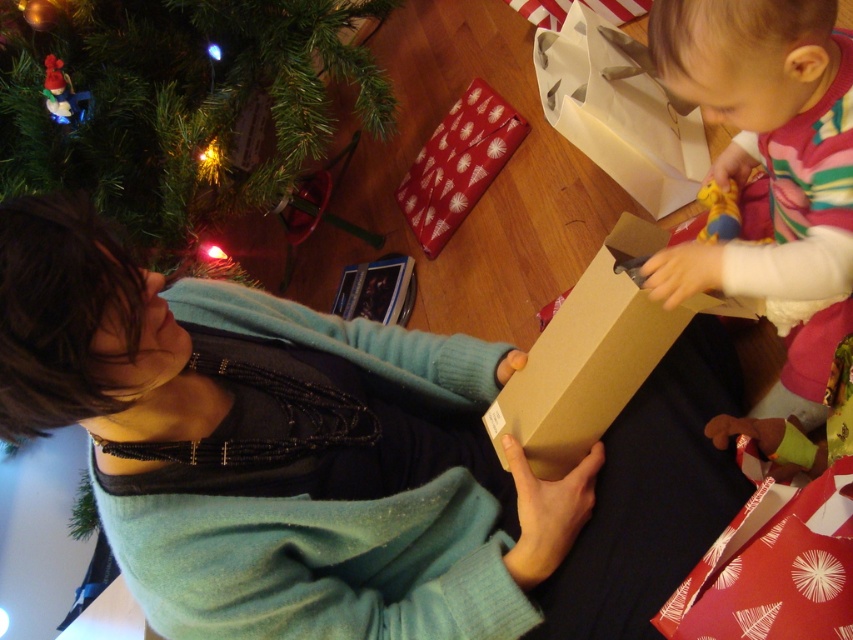
Can you confirm if green matte christmas tree at upper left is positioned to the right of striped fleece sweater at lower right?

Incorrect, green matte christmas tree at upper left is not on the right side of striped fleece sweater at lower right.

This screenshot has height=640, width=853. What do you see at coordinates (178, 106) in the screenshot?
I see `green matte christmas tree at upper left` at bounding box center [178, 106].

Does point (167, 180) come in front of point (827, 122)?

No, it is not.

I want to click on green matte christmas tree at upper left, so click(x=178, y=106).

Is matte brown box at center thinner than green matte christmas tree at upper left?

In fact, matte brown box at center might be wider than green matte christmas tree at upper left.

Identify the location of matte brown box at center. (341, 458).

Locate an element on the screen. The image size is (853, 640). matte brown box at center is located at coordinates (341, 458).

Who is lower down, striped fleece sweater at lower right or brown cardboard box at center?

brown cardboard box at center is below.

Locate an element on the screen. striped fleece sweater at lower right is located at coordinates (770, 166).

Find the location of a particular element. striped fleece sweater at lower right is located at coordinates (770, 166).